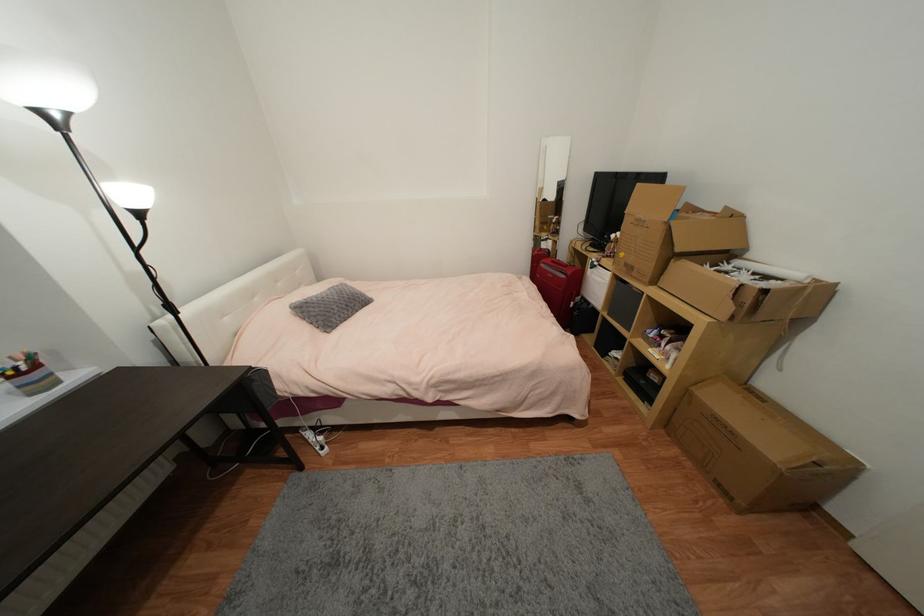
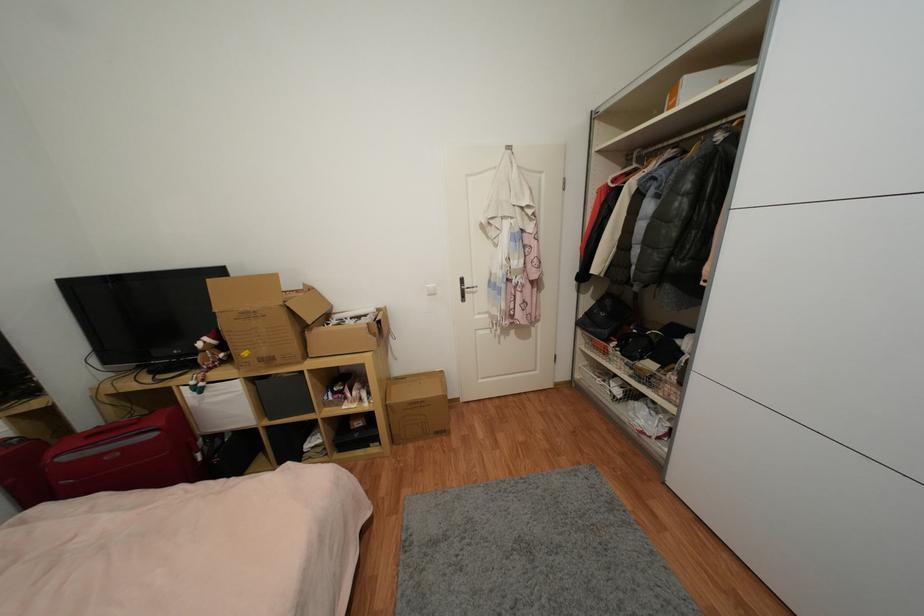
Question: Based on the continuous images, in which direction is the camera rotating? Reply with the corresponding letter.

Choices:
 (A) Left
 (B) Right
 (C) Up
 (D) Down

Answer: (B)